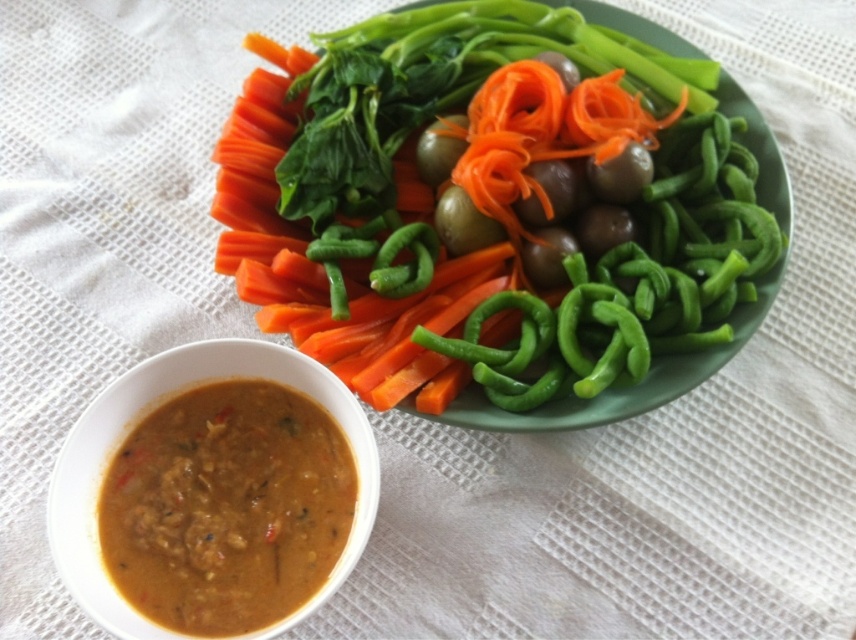
You are a food critic examining this dish. You need to describe the spatial arrangement of the brown creamy soup at lower left and the orange smooth carrot at center. Which one takes up more horizontal space?

The orange smooth carrot at center has a greater width than the brown creamy soup at lower left, so it occupies more horizontal space.

You are a chef preparing a dish and need to know the distance between the green glossy bell pepper at upper center and the brown creamy soup at lower left. Can you confirm if the distance is more than 30 centimeters?

The green glossy bell pepper at upper center is 34.52 centimeters away from the brown creamy soup at lower left, so the distance is more than 30 centimeters.

You are a food critic evaluating this dish. You notice the green glossy bell pepper at upper center and the orange smooth carrot at center. Which vegetable would you describe as being bigger in size?

The green glossy bell pepper at upper center is larger in size compared to the orange smooth carrot at center.